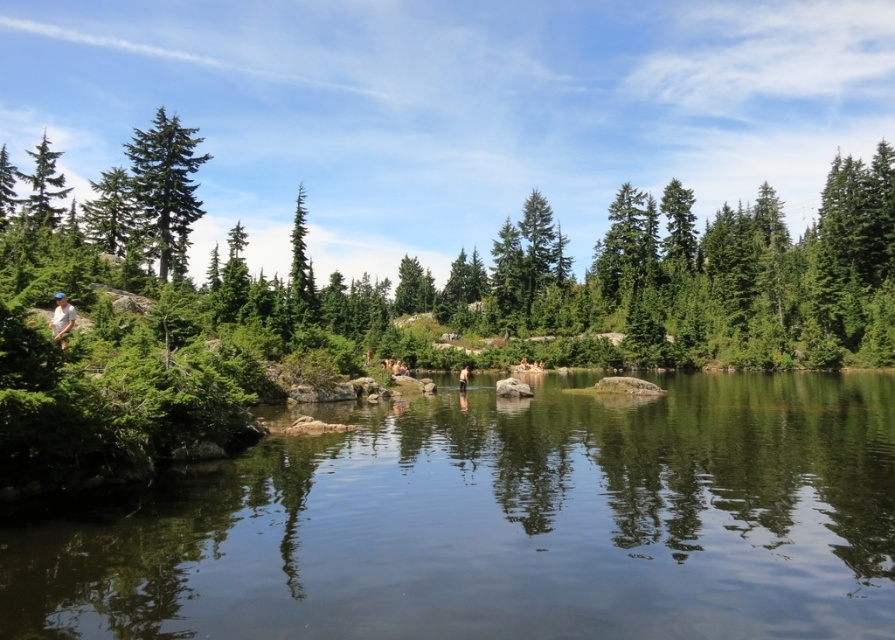
You are a photographer planning to capture a photo of the white cotton shirt at left and the skinny jeans at center in the serene natural setting. Based on their positions, which clothing item would appear closer to the water surface in the image?

The white cotton shirt at left is not as tall as the skinny jeans at center, so it would appear closer to the water surface in the image.

Looking at this image, you are a drone operator trying to capture a photo of the serene natural setting. The green matte tree at upper left is part of the background. To ensure the tree is in the frame, where should you position the drone relative to the scene?

The green matte tree at upper left is located at point (x=166, y=188), so you should position the drone to focus on the upper left area of the scene to capture the tree in the frame.